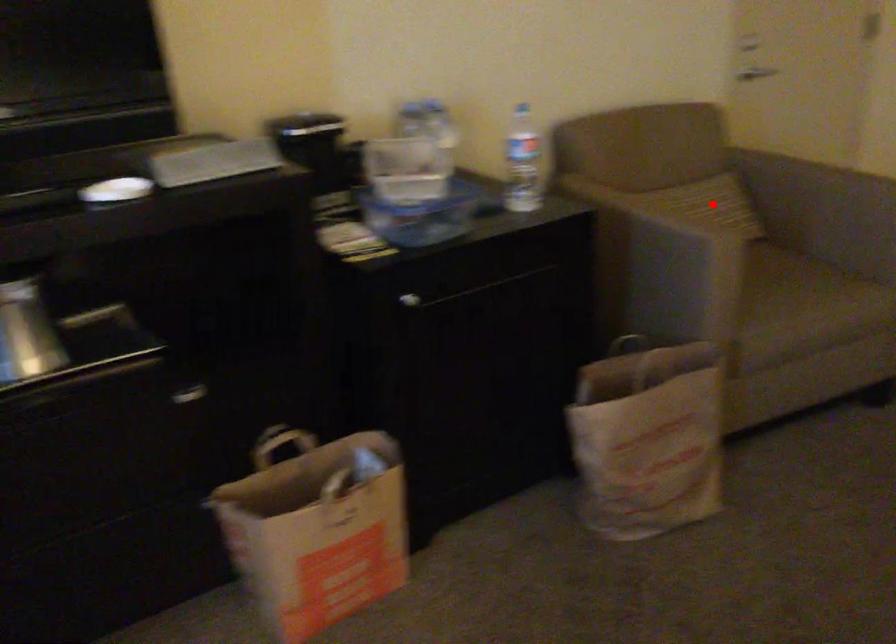
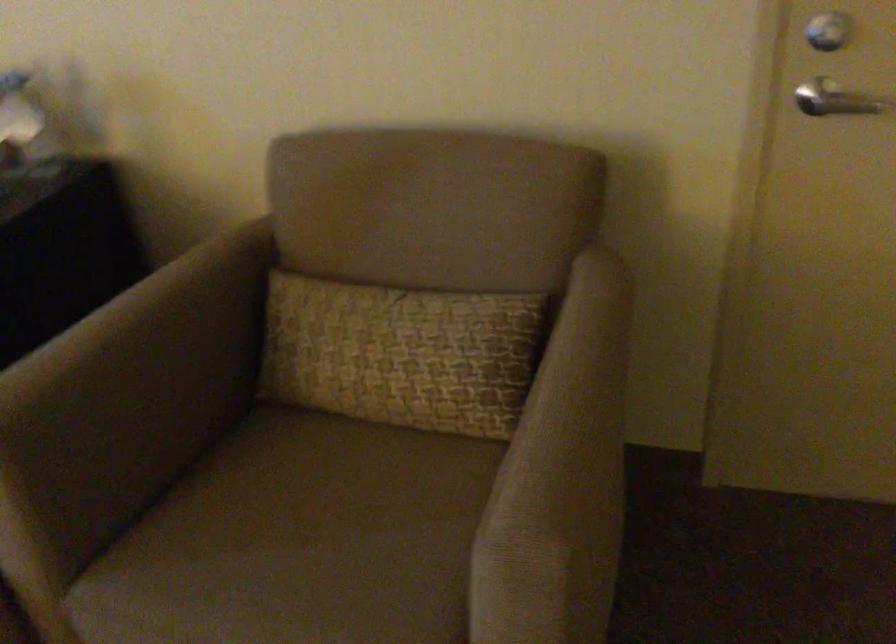
Question: A red point is marked in image1. In image2, is the corresponding 3D point closer to the camera or farther? Reply with the corresponding letter.

Choices:
 (A) The corresponding 3D point is closer.
 (B) The corresponding 3D point is farther.

Answer: (A)